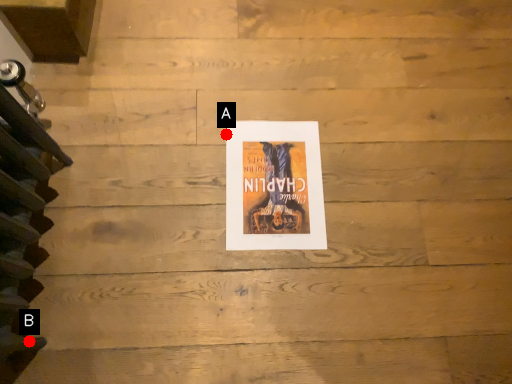
Question: Two points are circled on the image, labeled by A and B beside each circle. Which point appears closest to the camera in this image?

Choices:
 (A) A is closer
 (B) B is closer

Answer: (B)